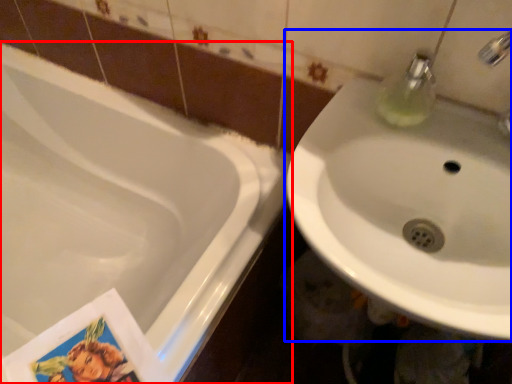
Question: Among these objects, which one is nearest to the camera, bathtub (highlighted by a red box) or sink (highlighted by a blue box)?

Choices:
 (A) bathtub
 (B) sink

Answer: (B)